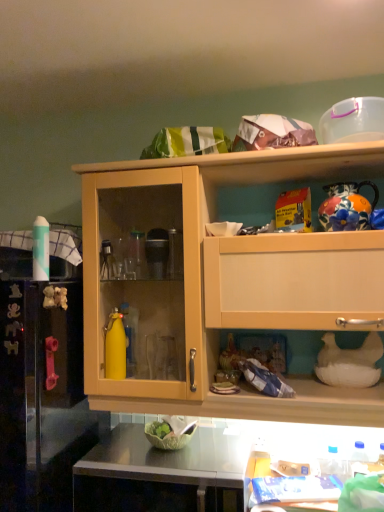
The image size is (384, 512). Identify the location of free space above white glossy table at lower center (from a real-world perspective). (296, 489).